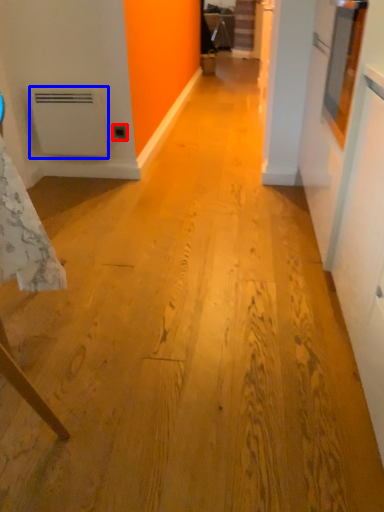
Question: Among these objects, which one is nearest to the camera, electric outlet (highlighted by a red box) or water heater (highlighted by a blue box)?

Choices:
 (A) electric outlet
 (B) water heater

Answer: (B)